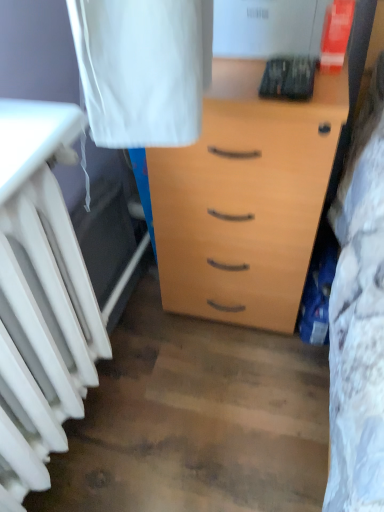
This screenshot has width=384, height=512. Describe the element at coordinates (245, 199) in the screenshot. I see `light wood chest of drawers at center` at that location.

Locate an element on the screen. light wood chest of drawers at center is located at coordinates (245, 199).

In order to face light wood chest of drawers at center, should I rotate leftwards or rightwards?

Rotate your view right by about 7.658°.

What is the approximate width of light wood chest of drawers at center?

The width of light wood chest of drawers at center is 63.58 centimeters.

The width and height of the screenshot is (384, 512). In order to click on white matte radiator at left in this screenshot , I will do `click(44, 321)`.

Image resolution: width=384 pixels, height=512 pixels. What do you see at coordinates (44, 321) in the screenshot?
I see `white matte radiator at left` at bounding box center [44, 321].

The width and height of the screenshot is (384, 512). In order to click on light wood chest of drawers at center in this screenshot , I will do `click(245, 199)`.

Considering the positions of objects light wood chest of drawers at center and white matte radiator at left in the image provided, who is more to the right, light wood chest of drawers at center or white matte radiator at left?

From the viewer's perspective, light wood chest of drawers at center appears more on the right side.

Which object is further away from the camera taking this photo, light wood chest of drawers at center or white matte radiator at left?

light wood chest of drawers at center is further away from the camera.

Which is nearer, (x=175, y=276) or (x=30, y=349)?

Point (x=30, y=349)

From the image's perspective, does light wood chest of drawers at center appear lower than white matte radiator at left?

Incorrect, from the image's perspective, light wood chest of drawers at center is higher than white matte radiator at left.

From a real-world perspective, does light wood chest of drawers at center stand above white matte radiator at left?

No, from a real-world perspective, light wood chest of drawers at center is not above white matte radiator at left.

Looking at their sizes, would you say light wood chest of drawers at center is wider or thinner than white matte radiator at left?

light wood chest of drawers at center is wider than white matte radiator at left.

Considering the relative sizes of light wood chest of drawers at center and white matte radiator at left in the image provided, is light wood chest of drawers at center taller than white matte radiator at left?

Indeed, light wood chest of drawers at center has a greater height compared to white matte radiator at left.

Who is smaller, light wood chest of drawers at center or white matte radiator at left?

white matte radiator at left is smaller.

Would you say light wood chest of drawers at center contains white matte radiator at left?

No, white matte radiator at left is not inside light wood chest of drawers at center.

Is light wood chest of drawers at center next to white matte radiator at left?

No, light wood chest of drawers at center is not beside white matte radiator at left.

Is light wood chest of drawers at center oriented towards white matte radiator at left?

Yes, light wood chest of drawers at center faces towards white matte radiator at left.

How many degrees apart are the facing directions of light wood chest of drawers at center and white matte radiator at left?

They differ by 91.1 degrees in their facing directions.

Locate an element on the screen. Image resolution: width=384 pixels, height=512 pixels. the chest of drawers lying behind the white matte radiator at left is located at coordinates (245, 199).

Can you confirm if white matte radiator at left is positioned to the right of light wood chest of drawers at center?

In fact, white matte radiator at left is to the left of light wood chest of drawers at center.

Which is in front, white matte radiator at left or light wood chest of drawers at center?

white matte radiator at left is in front.

Is point (55, 320) farther from camera compared to point (253, 238)?

No, it is in front of (253, 238).

From the image's perspective, is white matte radiator at left positioned above or below light wood chest of drawers at center?

Based on their image positions, white matte radiator at left is located beneath light wood chest of drawers at center.

From a real-world perspective, who is located higher, white matte radiator at left or light wood chest of drawers at center?

white matte radiator at left.

Considering the sizes of objects white matte radiator at left and light wood chest of drawers at center in the image provided, who is thinner, white matte radiator at left or light wood chest of drawers at center?

Thinner between the two is white matte radiator at left.

Between white matte radiator at left and light wood chest of drawers at center, which one has less height?

With less height is white matte radiator at left.

Is white matte radiator at left bigger or smaller than light wood chest of drawers at center?

Clearly, white matte radiator at left is smaller in size than light wood chest of drawers at center.

Does white matte radiator at left contain light wood chest of drawers at center?

No, light wood chest of drawers at center is not inside white matte radiator at left.

Is white matte radiator at left far away from light wood chest of drawers at center?

No, there isn't a large distance between white matte radiator at left and light wood chest of drawers at center.

Consider the image. Is white matte radiator at left aimed at light wood chest of drawers at center?

No, white matte radiator at left is not facing towards light wood chest of drawers at center.

How different are the orientations of white matte radiator at left and light wood chest of drawers at center in degrees?

The angular difference between white matte radiator at left and light wood chest of drawers at center is 91.1 degrees.

How much distance is there between white matte radiator at left and light wood chest of drawers at center?

white matte radiator at left is 40.60 centimeters from light wood chest of drawers at center.

Where is `chest of drawers that is on the right side of white matte radiator at left`? This screenshot has height=512, width=384. chest of drawers that is on the right side of white matte radiator at left is located at coordinates (245, 199).

The width and height of the screenshot is (384, 512). Identify the location of radiator that is on the left side of light wood chest of drawers at center. (44, 321).

Identify the location of chest of drawers on the right of white matte radiator at left. The width and height of the screenshot is (384, 512). (245, 199).